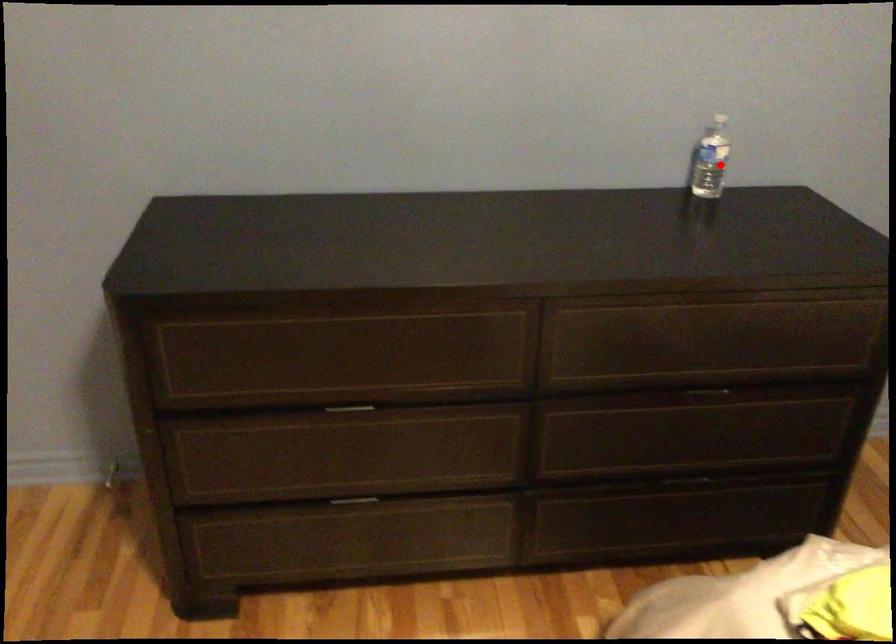
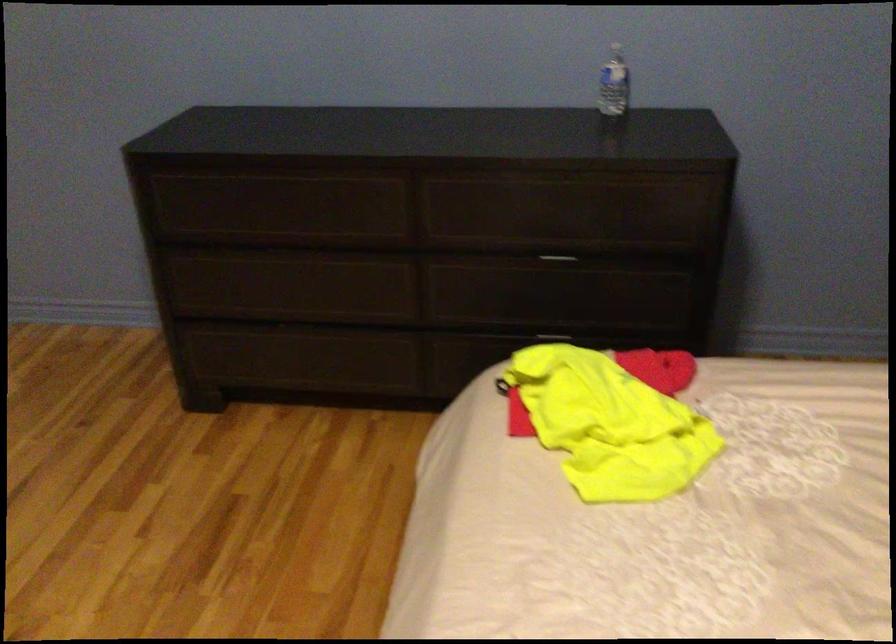
Question: I am providing you with two images of the same scene from different viewpoints. A red point is shown in image1. For the corresponding object point in image2, is it positioned nearer or farther from the camera?

Choices:
 (A) Nearer
 (B) Farther

Answer: (B)